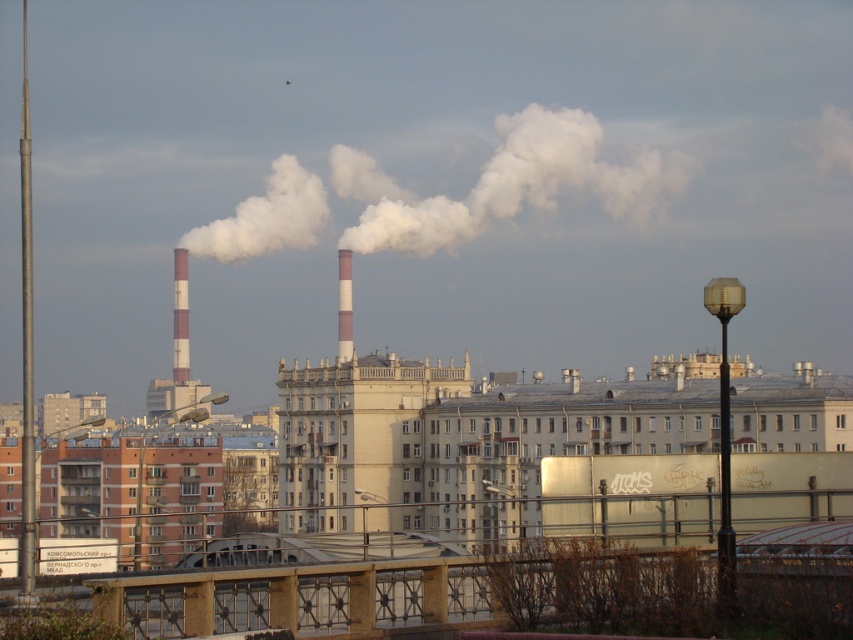
You are a city planner reviewing an aerial view of an industrial area. You notice two elements in the image, the white smoke at center and the red brick chimney at center. Which one is located to the right of the other?

The white smoke at center is positioned on the right side of the red brick chimney at center.

You are a city planner reviewing an aerial image of an industrial area. You notice a white smoke at center and a white striped chimney at center. Which object occupies a greater area in the image?

The white smoke at center is larger in size than the white striped chimney at center, so the white smoke at center occupies a greater area in the image.